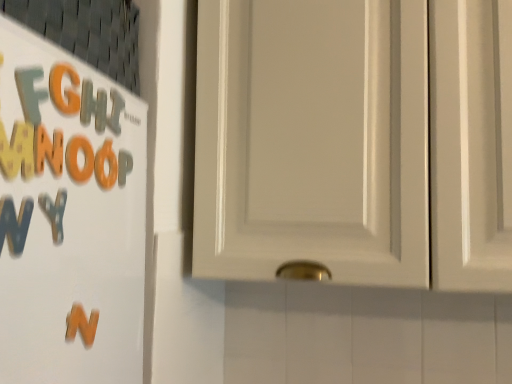
Find the location of `matte orange letter p at upper left, the first letter positioned from the back`. matte orange letter p at upper left, the first letter positioned from the back is located at coordinates (124, 166).

Describe the element at coordinates (124, 166) in the screenshot. I see `matte orange letter p at upper left, acting as the 6th letter starting from the front` at that location.

What is the approximate height of matte plastic letter at upper left, which ranks as the fifth letter in front-to-back order?

The height of matte plastic letter at upper left, which ranks as the fifth letter in front-to-back order, is 6.25 centimeters.

Measure the distance between orange foam letter at left, which appears as the 1th letter when viewed from the front, and camera.

The distance of orange foam letter at left, which appears as the 1th letter when viewed from the front, from camera is 15.26 inches.

In order to face orange foam letter at left, which appears as the 1th letter when viewed from the front, should I rotate leftwards or rightwards?

Turn left by 25.092 degrees to look at orange foam letter at left, which appears as the 1th letter when viewed from the front.

The height and width of the screenshot is (384, 512). Identify the location of orange matte letter at upper left, placed as the third letter when sorted from back to front. (108, 166).

What is the approximate height of orange matte letter n at left?

2.14 inches.

This screenshot has width=512, height=384. I want to click on matte orange letter g at upper left, the second letter in the front-to-back sequence, so click(65, 90).

Is orange matte letter n at left turned away from matte orange letter g at upper left, the 5th letter from the back?

No.

Considering the relative sizes of orange matte letter n at left and matte orange letter g at upper left, the 5th letter from the back, in the image provided, is orange matte letter n at left wider than matte orange letter g at upper left, the 5th letter from the back,?

Correct, the width of orange matte letter n at left exceeds that of matte orange letter g at upper left, the 5th letter from the back.

Can you confirm if orange matte letter n at left is positioned to the left of matte orange letter g at upper left, the 5th letter from the back?

No, orange matte letter n at left is not to the left of matte orange letter g at upper left, the 5th letter from the back.

Is orange foam letter at left, placed as the 6th letter when sorted from back to front, closer to camera compared to matte plastic letter at upper left, which ranks as the fifth letter in front-to-back order?

That is True.

Would you say orange foam letter at left, placed as the 6th letter when sorted from back to front, is inside or outside matte plastic letter at upper left, which ranks as the fifth letter in front-to-back order?

orange foam letter at left, placed as the 6th letter when sorted from back to front, is located beyond the bounds of matte plastic letter at upper left, which ranks as the fifth letter in front-to-back order.

From a real-world perspective, which object stands above the other?

In real-world perspective, matte plastic letter at upper left, acting as the 2th letter starting from the back, is above.

Can you tell me how much orange foam letter at left, placed as the 6th letter when sorted from back to front, and matte plastic letter at upper left, acting as the 2th letter starting from the back, differ in facing direction?

They differ by 0.0122 degrees in their facing directions.

Between matte orange letter g at upper left, the 5th letter from the back, and matte plastic letter at upper left, which ranks as the fifth letter in front-to-back order, which one appears on the right side from the viewer's perspective?

matte plastic letter at upper left, which ranks as the fifth letter in front-to-back order, is more to the right.

In the image, is matte orange letter g at upper left, the second letter in the front-to-back sequence, positioned in front of or behind matte plastic letter at upper left, which ranks as the fifth letter in front-to-back order?

Visually, matte orange letter g at upper left, the second letter in the front-to-back sequence, is located in front of matte plastic letter at upper left, which ranks as the fifth letter in front-to-back order.

Considering the sizes of objects matte orange letter g at upper left, the 5th letter from the back, and matte plastic letter at upper left, acting as the 2th letter starting from the back, in the image provided, who is taller, matte orange letter g at upper left, the 5th letter from the back, or matte plastic letter at upper left, acting as the 2th letter starting from the back,?

With more height is matte plastic letter at upper left, acting as the 2th letter starting from the back.

Where is `the 3rd letter behind the matte orange letter g at upper left, the 5th letter from the back, counting from the anchor's position`? The width and height of the screenshot is (512, 384). the 3rd letter behind the matte orange letter g at upper left, the 5th letter from the back, counting from the anchor's position is located at coordinates (115, 111).

Which object is wider, matte orange letter p at upper left, the first letter positioned from the back, or matte white cabinet at upper right?

With larger width is matte white cabinet at upper right.

From a real-world perspective, is matte orange letter p at upper left, acting as the 6th letter starting from the front, positioned over matte white cabinet at upper right based on gravity?

Incorrect, from a real-world perspective, matte orange letter p at upper left, acting as the 6th letter starting from the front, is lower than matte white cabinet at upper right.

How different are the orientations of matte orange letter p at upper left, the first letter positioned from the back, and matte white cabinet at upper right in degrees?

The angular difference between matte orange letter p at upper left, the first letter positioned from the back, and matte white cabinet at upper right is 89.3 degrees.

Looking at the image, does matte orange letter p at upper left, the first letter positioned from the back, seem bigger or smaller compared to matte white cabinet at upper right?

Considering their sizes, matte orange letter p at upper left, the first letter positioned from the back, takes up less space than matte white cabinet at upper right.

Locate an element on the screen. door above the orange matte letter n at left (from the image's perspective) is located at coordinates (355, 141).

Does matte white cabinet at upper right have a lesser width compared to orange matte letter n at left?

Incorrect, the width of matte white cabinet at upper right is not less than that of orange matte letter n at left.

From the image's perspective, is matte white cabinet at upper right above orange matte letter n at left?

Yes, from the image's perspective, matte white cabinet at upper right is on top of orange matte letter n at left.

How far apart are matte white cabinet at upper right and matte orange letter p at upper left, acting as the 6th letter starting from the front?

15.04 inches.

Consider the image. Is matte white cabinet at upper right to the left of matte orange letter p at upper left, acting as the 6th letter starting from the front, from the viewer's perspective?

No, matte white cabinet at upper right is not to the left of matte orange letter p at upper left, acting as the 6th letter starting from the front.

From the image's perspective, is matte white cabinet at upper right above or below matte orange letter p at upper left, acting as the 6th letter starting from the front?

matte white cabinet at upper right is situated higher than matte orange letter p at upper left, acting as the 6th letter starting from the front, in the image.

Are matte white cabinet at upper right and matte orange letter p at upper left, acting as the 6th letter starting from the front, far apart?

That's not correct — matte white cabinet at upper right is a little close to matte orange letter p at upper left, acting as the 6th letter starting from the front.

The width and height of the screenshot is (512, 384). Identify the location of alphabet below the matte plastic letter at upper left, acting as the 2th letter starting from the back (from the image's perspective). (81, 324).

Who is taller, matte plastic letter at upper left, which ranks as the fifth letter in front-to-back order, or orange matte letter n at left?

Standing taller between the two is matte plastic letter at upper left, which ranks as the fifth letter in front-to-back order.

Is matte plastic letter at upper left, which ranks as the fifth letter in front-to-back order, far from orange matte letter n at left?

Actually, matte plastic letter at upper left, which ranks as the fifth letter in front-to-back order, and orange matte letter n at left are a little close together.

Measure the distance from matte plastic letter at upper left, which ranks as the fifth letter in front-to-back order, to orange matte letter n at left.

matte plastic letter at upper left, which ranks as the fifth letter in front-to-back order, and orange matte letter n at left are 9.20 inches apart from each other.

This screenshot has width=512, height=384. In order to click on the 6th letter above the orange matte letter n at left (from the image's perspective) in this screenshot , I will do `click(65, 90)`.

The width and height of the screenshot is (512, 384). There is a matte plastic letter at upper left, acting as the 2th letter starting from the back. Identify the location of the 3rd letter below it (from a real-world perspective). (48, 150).

When comparing their distances from orange matte letter n at left, does orange foam letter at upper left, the 4th letter when ordered from back to front, or matte orange letter p at upper left, the first letter positioned from the back, seem closer?

Based on the image, orange foam letter at upper left, the 4th letter when ordered from back to front, appears to be nearer to orange matte letter n at left.

From the image, which object appears to be farther from matte white cabinet at upper right, matte orange letter g at upper left, the 5th letter from the back, or orange foam letter at upper left, the 4th letter when ordered from back to front?

matte orange letter g at upper left, the 5th letter from the back, lies further to matte white cabinet at upper right than the other object.

Based on their spatial positions, is orange matte letter n at left or orange foam letter at upper left, the 3th letter when ordered from front to back, further from matte orange letter p at upper left, the first letter positioned from the back?

Among the two, orange matte letter n at left is located further to matte orange letter p at upper left, the first letter positioned from the back.

Looking at the image, which one is located closer to orange matte letter at upper left, placed as the third letter when sorted from back to front, matte orange letter p at upper left, acting as the 6th letter starting from the front, or orange matte letter n at left?

Among the two, matte orange letter p at upper left, acting as the 6th letter starting from the front, is located nearer to orange matte letter at upper left, placed as the third letter when sorted from back to front.

Consider the image. Estimate the real-world distances between objects in this image. Which object is closer to matte orange letter g at upper left, the second letter in the front-to-back sequence, matte orange letter p at upper left, the first letter positioned from the back, or matte plastic letter at upper left, acting as the 2th letter starting from the back?

Among the two, matte plastic letter at upper left, acting as the 2th letter starting from the back, is located nearer to matte orange letter g at upper left, the second letter in the front-to-back sequence.

Estimate the real-world distances between objects in this image. Which object is further from orange foam letter at upper left, the 3th letter when ordered from front to back, orange foam letter at left, placed as the 6th letter when sorted from back to front, or matte orange letter g at upper left, the second letter in the front-to-back sequence?

Among the two, matte orange letter g at upper left, the second letter in the front-to-back sequence, is located further to orange foam letter at upper left, the 3th letter when ordered from front to back.

From the image, which object appears to be farther from orange foam letter at left, which appears as the 1th letter when viewed from the front, matte white cabinet at upper right or orange matte letter n at left?

The object further to orange foam letter at left, which appears as the 1th letter when viewed from the front, is matte white cabinet at upper right.

Which object lies further to the anchor point orange foam letter at left, which appears as the 1th letter when viewed from the front, orange foam letter at upper left, the 4th letter when ordered from back to front, or matte orange letter g at upper left, the second letter in the front-to-back sequence?

matte orange letter g at upper left, the second letter in the front-to-back sequence, is further to orange foam letter at left, which appears as the 1th letter when viewed from the front.

Locate an element on the screen. The width and height of the screenshot is (512, 384). letter between orange foam letter at upper left, the 3th letter when ordered from front to back, and matte plastic letter at upper left, acting as the 2th letter starting from the back, from front to back is located at coordinates (108, 166).

At what (x,y) coordinates should I click in order to perform the action: click on alphabet situated between orange foam letter at left, placed as the 6th letter when sorted from back to front, and matte white cabinet at upper right from left to right. Please return your answer as a coordinate pair (x, y). The width and height of the screenshot is (512, 384). Looking at the image, I should click on click(x=81, y=324).

Where is `letter situated between matte plastic letter at upper left, which ranks as the fifth letter in front-to-back order, and matte white cabinet at upper right from left to right`? letter situated between matte plastic letter at upper left, which ranks as the fifth letter in front-to-back order, and matte white cabinet at upper right from left to right is located at coordinates (124, 166).

Where is `alphabet between matte orange letter g at upper left, the 5th letter from the back, and matte white cabinet at upper right from left to right`? The width and height of the screenshot is (512, 384). alphabet between matte orange letter g at upper left, the 5th letter from the back, and matte white cabinet at upper right from left to right is located at coordinates (81, 324).